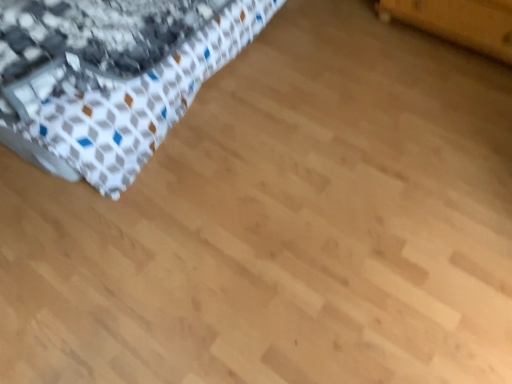
What is the approximate height of white woven basket at upper left?

white woven basket at upper left is 20.32 inches in height.

Where is `white woven basket at upper left`? white woven basket at upper left is located at coordinates (125, 102).

This screenshot has width=512, height=384. What do you see at coordinates (125, 102) in the screenshot?
I see `white woven basket at upper left` at bounding box center [125, 102].

Identify the location of white woven basket at upper left. The width and height of the screenshot is (512, 384). (125, 102).